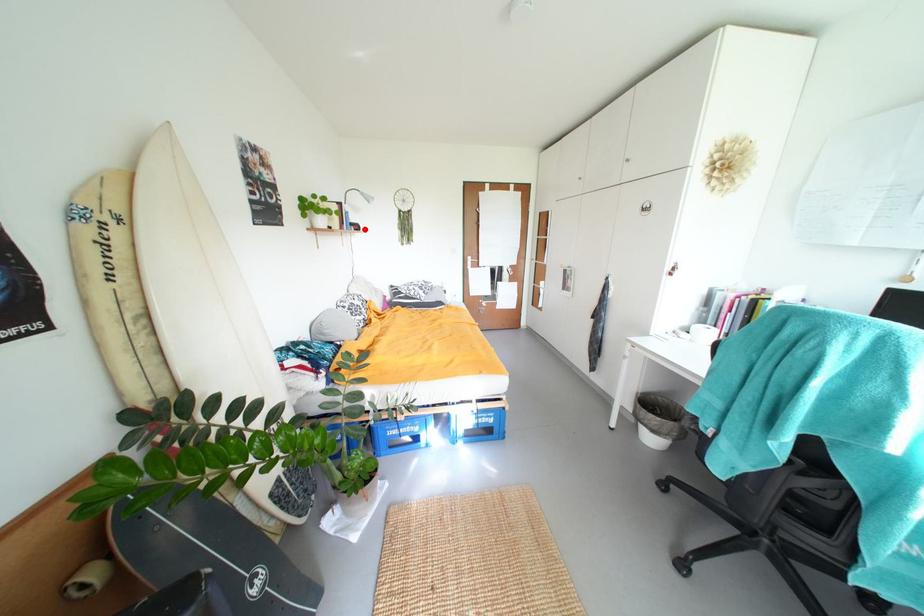
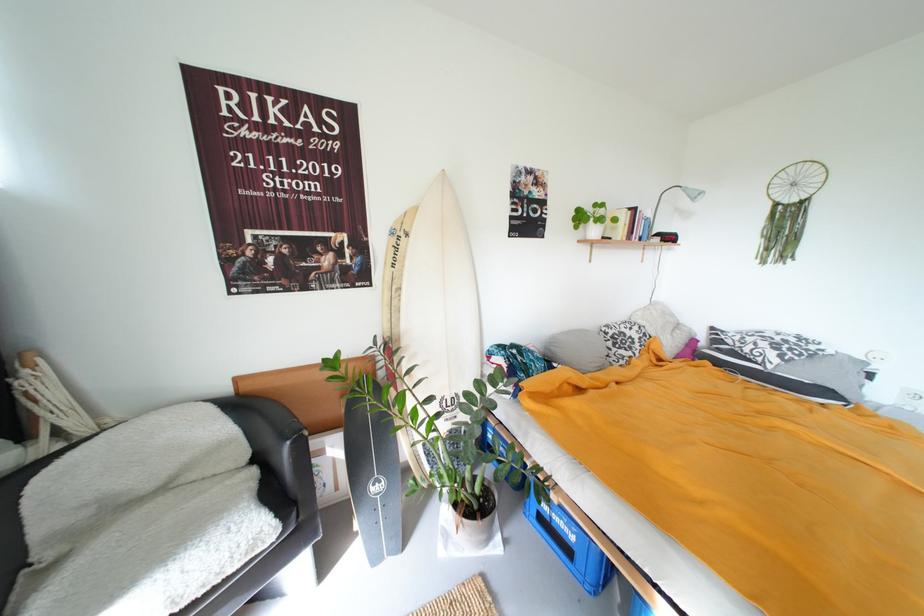
Where in the second image is the point corresponding to the highlighted location from the first image?

(677, 240)